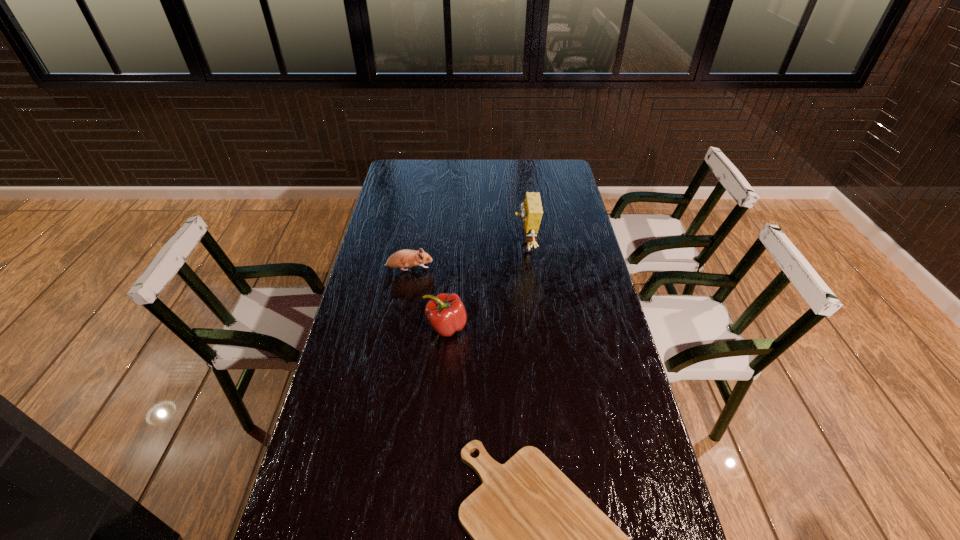
Locate an element on the screen. This screenshot has height=540, width=960. the tallest object is located at coordinates (531, 209).

The height and width of the screenshot is (540, 960). I want to click on pepper, so click(446, 313).

Where is `the second tallest object`? This screenshot has width=960, height=540. the second tallest object is located at coordinates (446, 313).

Locate an element on the screen. hamster is located at coordinates click(401, 259).

Where is `vacant point located on the face of the tallest object`? vacant point located on the face of the tallest object is located at coordinates (492, 247).

The width and height of the screenshot is (960, 540). In order to click on free region located 0.220m on the face of the tallest object in this screenshot , I will do `click(456, 247)`.

At what (x,y) coordinates should I click in order to perform the action: click on vacant space located 0.180m on the face of the tallest object. Please return your answer as a coordinate pair (x, y). The width and height of the screenshot is (960, 540). Looking at the image, I should click on (467, 247).

Locate an element on the screen. The image size is (960, 540). free space located on the right of the third shortest object is located at coordinates (574, 327).

The image size is (960, 540). Identify the location of vacant region located 0.120m at the face of the second shortest object. (466, 269).

Identify the location of object that is at the left edge. Image resolution: width=960 pixels, height=540 pixels. (401, 259).